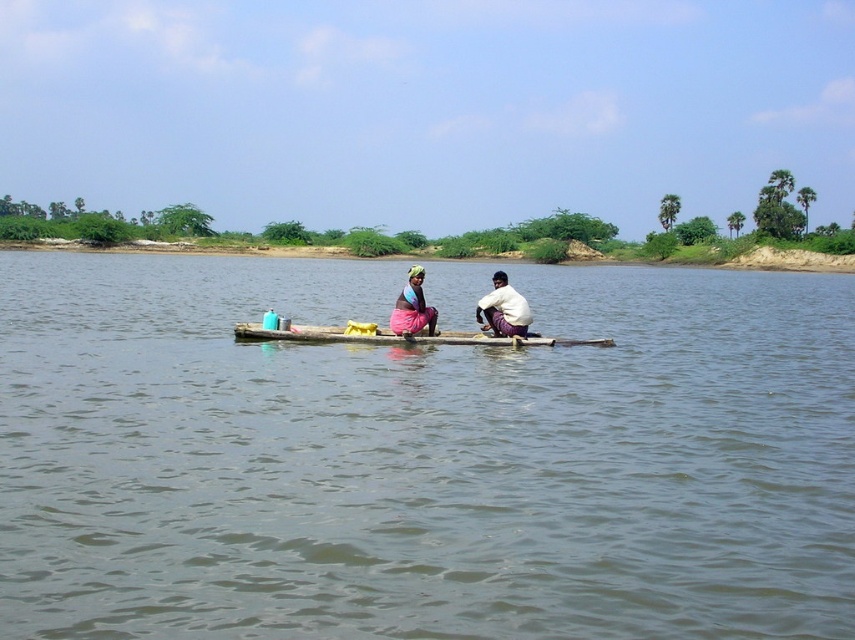
Does wooden log boat at center have a greater width compared to white cotton shirt at center?

Indeed, wooden log boat at center has a greater width compared to white cotton shirt at center.

Where is `wooden log boat at center`? This screenshot has height=640, width=855. wooden log boat at center is located at coordinates (398, 337).

Find the location of a particular element. The width and height of the screenshot is (855, 640). wooden log boat at center is located at coordinates (398, 337).

Where is `wooden log boat at center`? wooden log boat at center is located at coordinates (398, 337).

Which is below, brown wooden raft at center or matte pink fabric at center?

matte pink fabric at center is lower down.

Who is more distant from viewer, (476,394) or (407,333)?

The point (407,333) is behind.

Identify the location of brown wooden raft at center. (422, 456).

Between point (299, 339) and point (419, 301), which one is positioned behind?

Point (299, 339)

Can you confirm if wooden log boat at center is bigger than matte pink fabric at center?

Indeed, wooden log boat at center has a larger size compared to matte pink fabric at center.

Locate an element on the screen. wooden log boat at center is located at coordinates (398, 337).